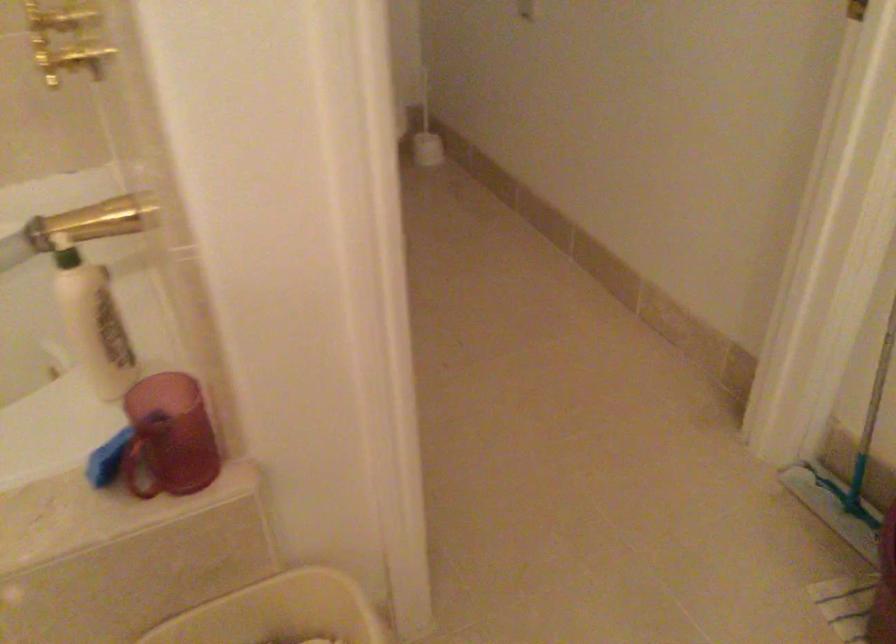
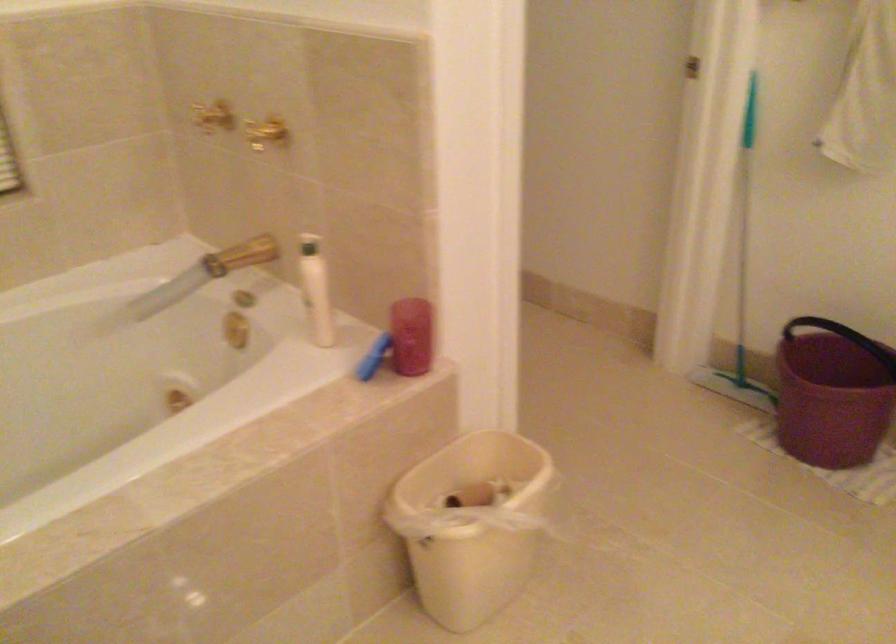
Locate, in the second image, the point that corresponds to the point at 88,319 in the first image.

(315, 289)